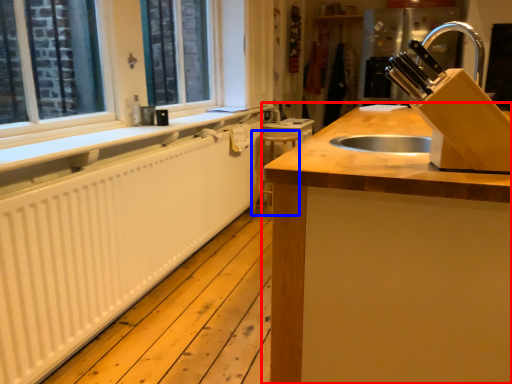
Question: Which object appears farthest to the camera in this image, countertop (highlighted by a red box) or step stool (highlighted by a blue box)?

Choices:
 (A) countertop
 (B) step stool

Answer: (B)